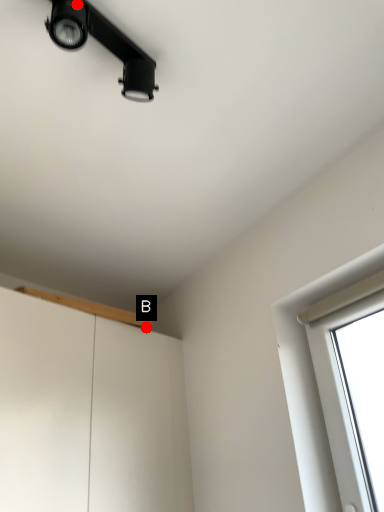
Question: Two points are circled on the image, labeled by A and B beside each circle. Which point is farther from the camera taking this photo?

Choices:
 (A) A is further
 (B) B is further

Answer: (B)